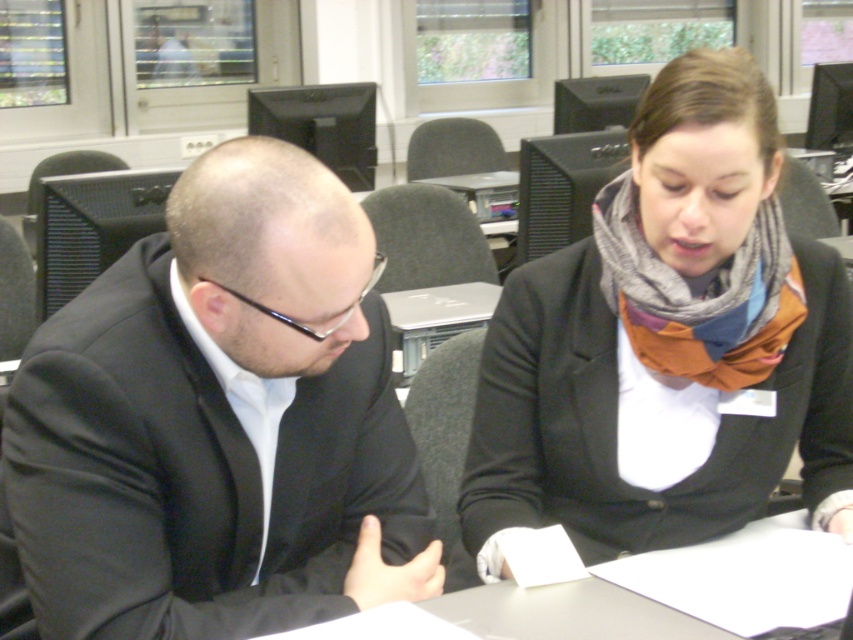
You are an office worker who needs to choose between the black matte suit at left and the knitted scarf at center for a presentation. Which item has a narrower width?

The black matte suit at left is thinner than the knitted scarf at center, so the black matte suit at left has a narrower width.

You are a delivery robot that needs to deliver a package to the table where the two people are sitting. The package is 12 inches in height. The table is at point (339, 262). What is the minimum height your robot needs to be to place the package on the table?

The distance of point (339, 262) from the camera is 37.18 inches. To place the package on the table, the robot must be at least 37.18 inches tall plus the 12 inches of the package, so the minimum height required is 49.18 inches.

You are a photographer taking a picture of the black matte suit at left and the knitted scarf at center. Which object should you focus on first if you want to capture both in the frame without moving the camera?

The black matte suit at left is to the left of knitted scarf at center, so you should focus on the black matte suit at left first to ensure both are in frame without moving the camera.